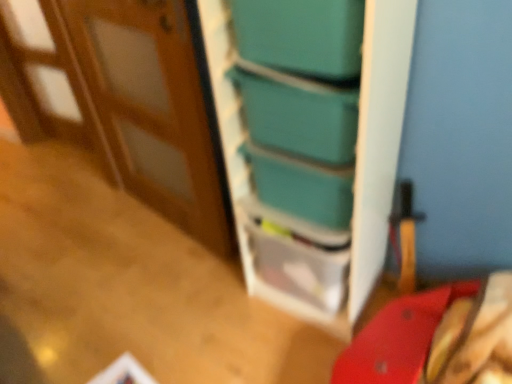
At what (x,y) coordinates should I click in order to perform the action: click on free space to the left of wooden at left. Please return your answer as a coordinate pair (x, y). The image size is (512, 384). Looking at the image, I should click on (90, 259).